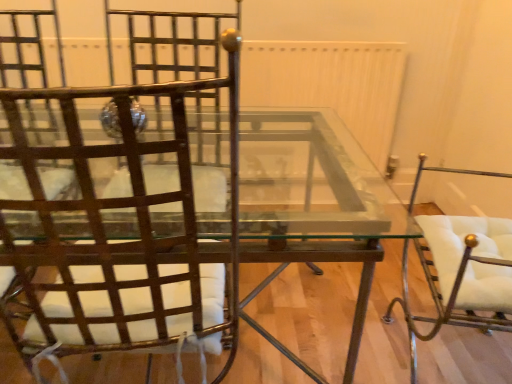
Question: Is white leather chair at right, which is counted as the first chair, starting from the right, facing away from clear glass table at center?

Choices:
 (A) no
 (B) yes

Answer: (A)

Question: Is white leather chair at right, which is counted as the second chair, starting from the left, at the left side of clear glass table at center?

Choices:
 (A) no
 (B) yes

Answer: (A)

Question: Does white leather chair at right, which is counted as the second chair, starting from the left, have a lesser height compared to clear glass table at center?

Choices:
 (A) yes
 (B) no

Answer: (B)

Question: Is white leather chair at right, which is counted as the second chair, starting from the left, bigger than clear glass table at center?

Choices:
 (A) no
 (B) yes

Answer: (A)

Question: Is white leather chair at right, which is counted as the second chair, starting from the left, aimed at clear glass table at center?

Choices:
 (A) yes
 (B) no

Answer: (B)

Question: Does white leather chair at right, which is counted as the second chair, starting from the left, have a lesser width compared to clear glass table at center?

Choices:
 (A) no
 (B) yes

Answer: (B)

Question: Considering the relative positions of metallic brown chair at left, acting as the second chair starting from the right, and white leather chair at right, which is counted as the first chair, starting from the right, in the image provided, is metallic brown chair at left, acting as the second chair starting from the right, to the right of white leather chair at right, which is counted as the first chair, starting from the right, from the viewer's perspective?

Choices:
 (A) yes
 (B) no

Answer: (B)

Question: Can you confirm if metallic brown chair at left, marked as the 1th chair in a left-to-right arrangement, is positioned to the left of white leather chair at right, which is counted as the first chair, starting from the right?

Choices:
 (A) yes
 (B) no

Answer: (A)

Question: Is metallic brown chair at left, marked as the 1th chair in a left-to-right arrangement, bigger than white leather chair at right, which is counted as the first chair, starting from the right?

Choices:
 (A) yes
 (B) no

Answer: (A)

Question: Is metallic brown chair at left, acting as the second chair starting from the right, positioned behind white leather chair at right, which is counted as the second chair, starting from the left?

Choices:
 (A) no
 (B) yes

Answer: (A)

Question: Can you confirm if metallic brown chair at left, marked as the 1th chair in a left-to-right arrangement, is thinner than white leather chair at right, which is counted as the first chair, starting from the right?

Choices:
 (A) no
 (B) yes

Answer: (A)

Question: Is metallic brown chair at left, marked as the 1th chair in a left-to-right arrangement, directly adjacent to white leather chair at right, which is counted as the second chair, starting from the left?

Choices:
 (A) yes
 (B) no

Answer: (B)

Question: Does white leather chair at right, which is counted as the second chair, starting from the left, have a greater height compared to metallic brown chair at left, acting as the second chair starting from the right?

Choices:
 (A) yes
 (B) no

Answer: (A)